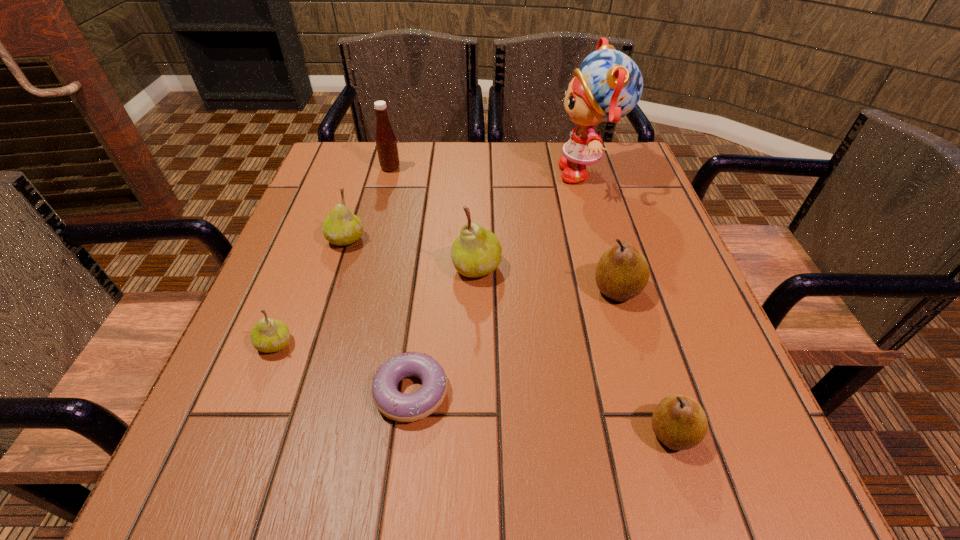
Locate an element on the screen. vacant space situated on the left of the nearer brown pear is located at coordinates click(389, 433).

This screenshot has height=540, width=960. Find the location of `vacant area located 0.110m on the back of the shortest object`. vacant area located 0.110m on the back of the shortest object is located at coordinates (420, 309).

Locate an element on the screen. Image resolution: width=960 pixels, height=540 pixels. doll that is at the far edge is located at coordinates (608, 85).

Where is `Tabasco sauce that is positioned at the far edge`? The image size is (960, 540). Tabasco sauce that is positioned at the far edge is located at coordinates (386, 143).

Find the location of a particular element. This screenshot has width=960, height=540. object at the near edge is located at coordinates (679, 422).

This screenshot has width=960, height=540. Find the location of `Tabasco sauce present at the left edge`. Tabasco sauce present at the left edge is located at coordinates (386, 143).

The height and width of the screenshot is (540, 960). Identify the location of doll that is at the right edge. (608, 85).

The width and height of the screenshot is (960, 540). Find the location of `object located in the far left corner section of the desktop`. object located in the far left corner section of the desktop is located at coordinates (386, 143).

Where is `object situated at the far right corner`? object situated at the far right corner is located at coordinates (608, 85).

This screenshot has width=960, height=540. What are the coordinates of `object located in the near right corner section of the desktop` in the screenshot? It's located at click(x=679, y=422).